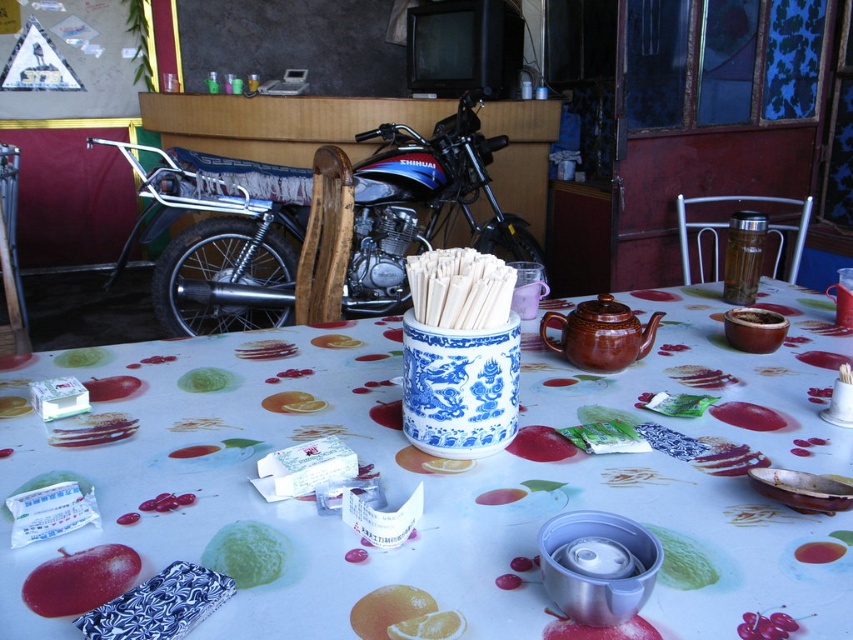
Which is more to the right, fruit-patterned fabric at center or shiny metallic motorcycle at center?

Positioned to the right is fruit-patterned fabric at center.

Does fruit-patterned fabric at center have a greater height compared to shiny metallic motorcycle at center?

In fact, fruit-patterned fabric at center may be shorter than shiny metallic motorcycle at center.

The width and height of the screenshot is (853, 640). In order to click on fruit-patterned fabric at center in this screenshot , I will do `click(447, 481)`.

I want to click on fruit-patterned fabric at center, so (x=447, y=481).

Can you confirm if fruit-patterned fabric at center is positioned above red matte apple at lower left?

Yes, fruit-patterned fabric at center is above red matte apple at lower left.

At what (x,y) coordinates should I click in order to perform the action: click on fruit-patterned fabric at center. Please return your answer as a coordinate pair (x, y). This screenshot has width=853, height=640. Looking at the image, I should click on (447, 481).

Which is in front, point (554, 460) or point (96, 560)?

Point (96, 560) is in front.

The height and width of the screenshot is (640, 853). I want to click on fruit-patterned fabric at center, so click(x=447, y=481).

Is point (357, 141) closer to viewer compared to point (128, 563)?

No, it is not.

Is shiny metallic motorcycle at center to the left of red matte apple at lower left from the viewer's perspective?

Yes, shiny metallic motorcycle at center is to the left of red matte apple at lower left.

Locate an element on the screen. The width and height of the screenshot is (853, 640). shiny metallic motorcycle at center is located at coordinates (318, 227).